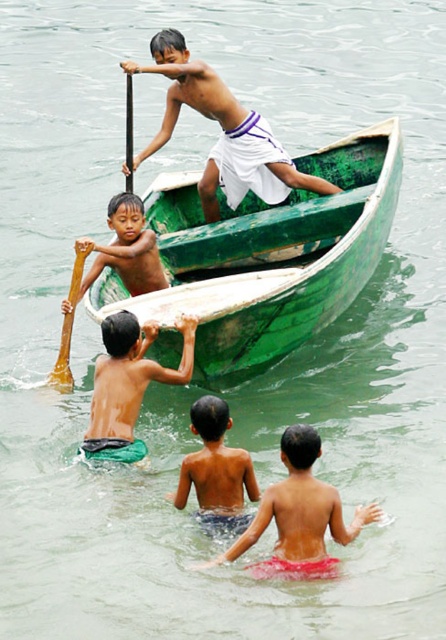
Question: Which of the following is the farthest from the observer?

Choices:
 (A) (151, 232)
 (B) (156, 189)

Answer: (B)

Question: Is smooth skin child at lower center closer to the viewer compared to brown wood paddle at lower left?

Choices:
 (A) no
 (B) yes

Answer: (B)

Question: Which object appears farthest from the camera in this image?

Choices:
 (A) brown wood paddle at lower left
 (B) matte white shorts at upper center
 (C) light brown wooden paddle at upper left

Answer: (B)

Question: Can you confirm if green matte boat at center is positioned to the right of brown wood paddle at lower left?

Choices:
 (A) no
 (B) yes

Answer: (B)

Question: Is green fabric shorts at lower left bigger than brown wood paddle at lower left?

Choices:
 (A) yes
 (B) no

Answer: (B)

Question: Based on their relative distances, which object is farther from the smooth skin boy at lower center?

Choices:
 (A) green matte boat at center
 (B) brown wood paddle at lower left
 (C) matte white shorts at upper center

Answer: (C)